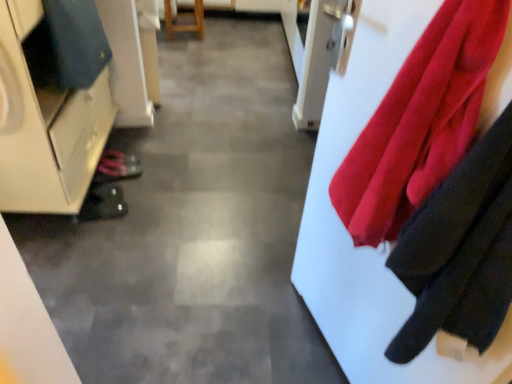
Identify the location of vacant space underneath wooden stool at center (from a real-world perspective). (183, 36).